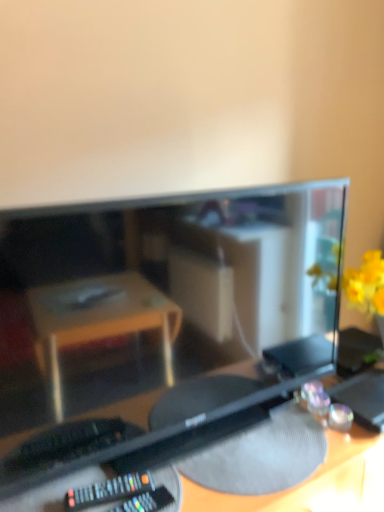
Question: Considering the positions of black plastic remote at lower left and black plastic desk at center in the image, is black plastic remote at lower left taller or shorter than black plastic desk at center?

Choices:
 (A) tall
 (B) short

Answer: (B)

Question: Relative to black plastic desk at center, is black plastic remote at lower left in front or behind?

Choices:
 (A) front
 (B) behind

Answer: (B)

Question: Which is farther from the black plastic remote at lower left?

Choices:
 (A) black plastic desk at center
 (B) matte black monitor at center

Answer: (B)

Question: Estimate the real-world distances between objects in this image. Which object is closer to the black plastic remote at lower left?

Choices:
 (A) matte black monitor at center
 (B) black plastic desk at center

Answer: (B)